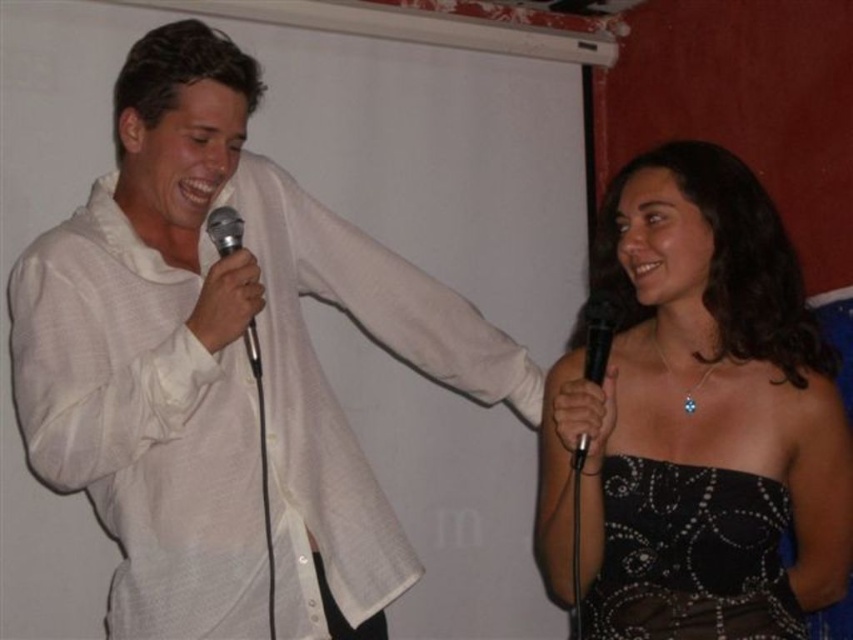
Question: Does black satin dress at right have a larger size compared to metallic silver microphone at left?

Choices:
 (A) no
 (B) yes

Answer: (B)

Question: Which object is the closest to the metallic silver microphone at left?

Choices:
 (A) black sequined dress at lower right
 (B) black matte microphone at right

Answer: (B)

Question: Among these objects, which one is farthest from the camera?

Choices:
 (A) white linen shirt at left
 (B) black matte microphone at right
 (C) black satin dress at right
 (D) black sequined dress at lower right

Answer: (A)

Question: From the image, what is the correct spatial relationship of white linen shirt at left in relation to black sequined dress at lower right?

Choices:
 (A) below
 (B) above

Answer: (B)

Question: Is the position of white linen shirt at left less distant than that of black satin dress at right?

Choices:
 (A) no
 (B) yes

Answer: (A)

Question: Which point is closer to the camera?

Choices:
 (A) (242, 513)
 (B) (682, 342)
 (C) (604, 372)
 (D) (218, 209)

Answer: (C)